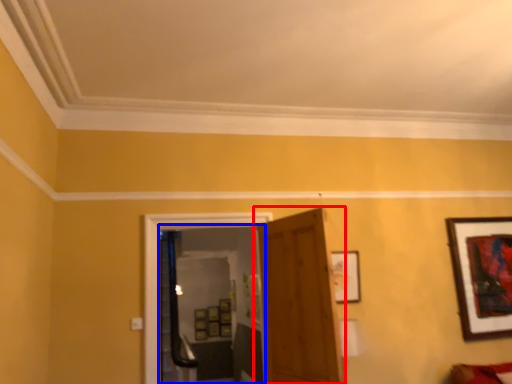
Question: Among these objects, which one is farthest to the camera, door (highlighted by a red box) or glass door (highlighted by a blue box)?

Choices:
 (A) door
 (B) glass door

Answer: (B)